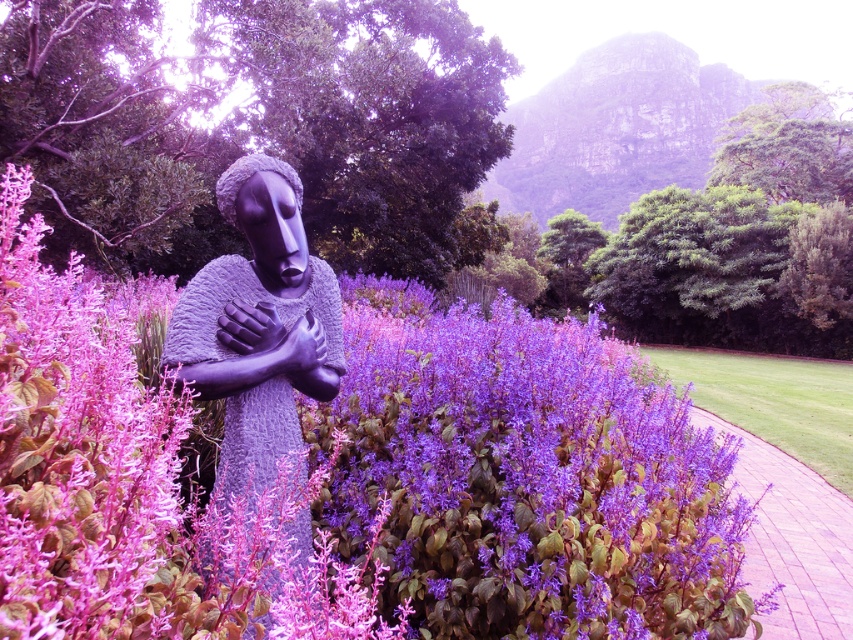
Does matte gray hand at center appear on the left side of matte black hand at center?

Yes, matte gray hand at center is to the left of matte black hand at center.

Is matte gray hand at center smaller than matte black hand at center?

Yes.

Where is `matte gray hand at center`? This screenshot has width=853, height=640. matte gray hand at center is located at coordinates (248, 326).

Where is `matte gray hand at center`? Image resolution: width=853 pixels, height=640 pixels. matte gray hand at center is located at coordinates (248, 326).

Measure the distance between matte black statue at center and matte gray hand at center.

11.17 inches

Does matte black statue at center have a lesser width compared to matte gray hand at center?

In fact, matte black statue at center might be wider than matte gray hand at center.

Which is in front, point (184, 324) or point (247, 321)?

Point (184, 324)

Identify the location of matte black statue at center. (259, 352).

Which is in front, point (132, 484) or point (323, 333)?

Point (132, 484) is more forward.

Can you confirm if purple matte flower at center is smaller than matte black hand at center?

No, purple matte flower at center is not smaller than matte black hand at center.

Is point (384, 477) positioned after point (310, 355)?

That is True.

You are a GUI agent. You are given a task and a screenshot of the screen. Output one action in this format:
    pyautogui.click(x=<x>, y=<y>)
    Task: Click on the purple matte flower at center
    The width and height of the screenshot is (853, 640).
    Given the screenshot: What is the action you would take?
    pyautogui.click(x=352, y=476)